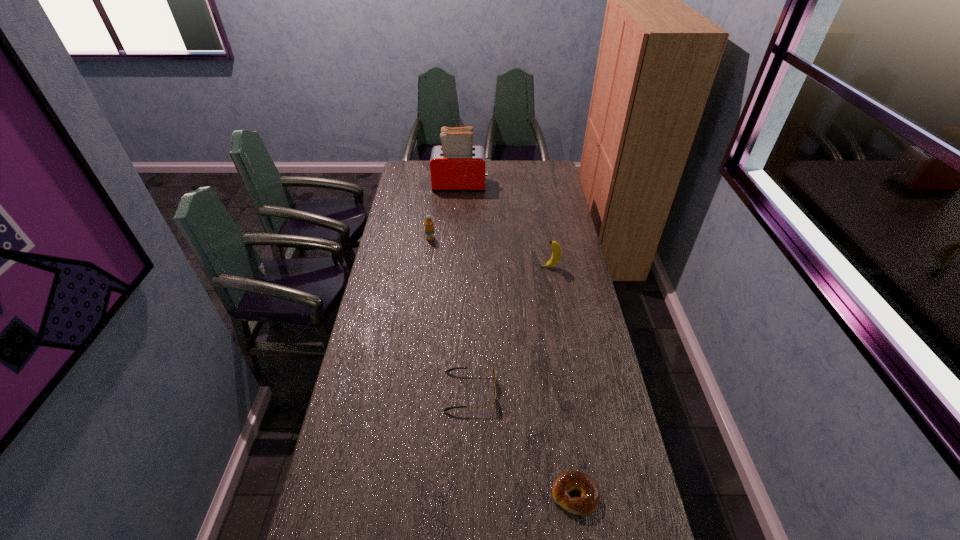
You are a GUI agent. You are given a task and a screenshot of the screen. Output one action in this format:
    pyautogui.click(x=<x>, y=<y>)
    Task: Click on the free space that satisfies the following two spatial constraints: 1. on the front-facing side of the farthest object; 2. on the right side of the nearest object
    
    Given the screenshot: What is the action you would take?
    pyautogui.click(x=444, y=494)

Where is `free space that satisfies the following two spatial constraints: 1. on the front-facing side of the shortest object; 2. on the right side of the tallest object`? The image size is (960, 540). free space that satisfies the following two spatial constraints: 1. on the front-facing side of the shortest object; 2. on the right side of the tallest object is located at coordinates (444, 494).

In order to click on vacant space that satisfies the following two spatial constraints: 1. on the label of the bagel; 2. on the left side of the third tallest object in this screenshot , I will do `click(396, 494)`.